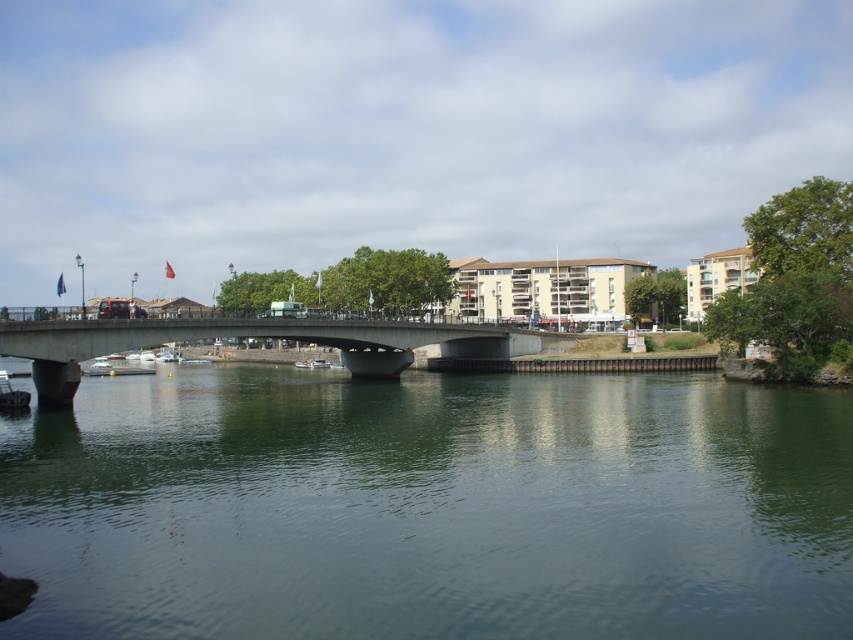
Does green smooth water at center appear under concrete bridge at center?

Indeed, green smooth water at center is positioned under concrete bridge at center.

Is point (695, 477) positioned after point (273, 333)?

No, (695, 477) is in front of (273, 333).

The height and width of the screenshot is (640, 853). Identify the location of green smooth water at center. (430, 508).